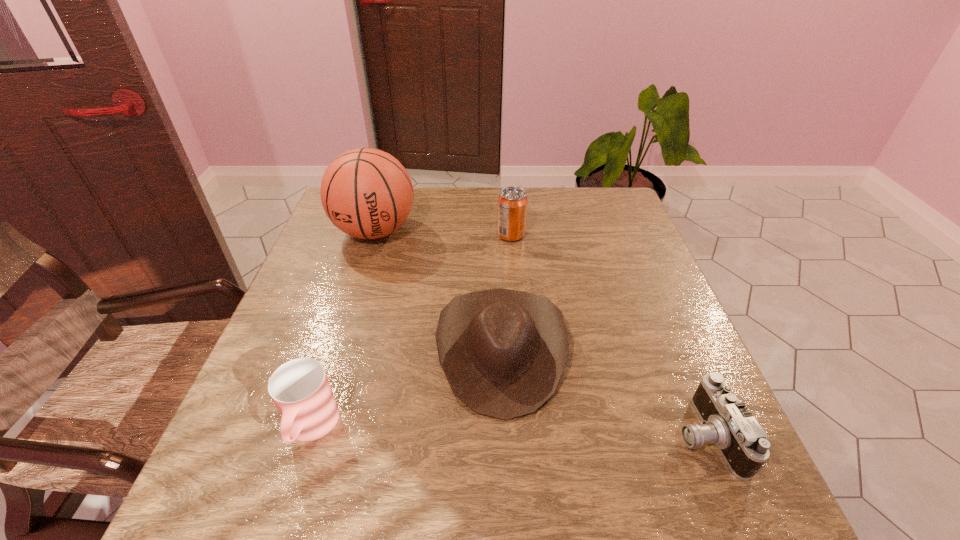
You are a GUI agent. You are given a task and a screenshot of the screen. Output one action in this format:
    pyautogui.click(x=<x>, y=<y>)
    Task: Click on the vacant space located at the lens of the shortest object
    Image resolution: width=960 pixels, height=540 pixels.
    Given the screenshot: What is the action you would take?
    pyautogui.click(x=492, y=435)

Locate an element on the screen. The width and height of the screenshot is (960, 540). free space located at the lens of the shortest object is located at coordinates (553, 435).

I want to click on vacant space located at the lens of the shortest object, so click(x=559, y=435).

Identify the location of basketball located in the far edge section of the desktop. Image resolution: width=960 pixels, height=540 pixels. (367, 193).

The image size is (960, 540). In order to click on soda can at the far edge in this screenshot , I will do `click(512, 202)`.

You are a GUI agent. You are given a task and a screenshot of the screen. Output one action in this format:
    pyautogui.click(x=<x>, y=<y>)
    Task: Click on the object present at the near edge
    
    Given the screenshot: What is the action you would take?
    point(726,422)

Where is `basketball that is at the left edge`? basketball that is at the left edge is located at coordinates (367, 193).

Locate an element on the screen. The image size is (960, 540). cup at the left edge is located at coordinates (300, 389).

This screenshot has width=960, height=540. Identify the location of object positioned at the right edge. (726, 422).

At what (x,y) coordinates should I click in order to perform the action: click on object situated at the far left corner. Please return your answer as a coordinate pair (x, y). This screenshot has height=540, width=960. Looking at the image, I should click on (367, 193).